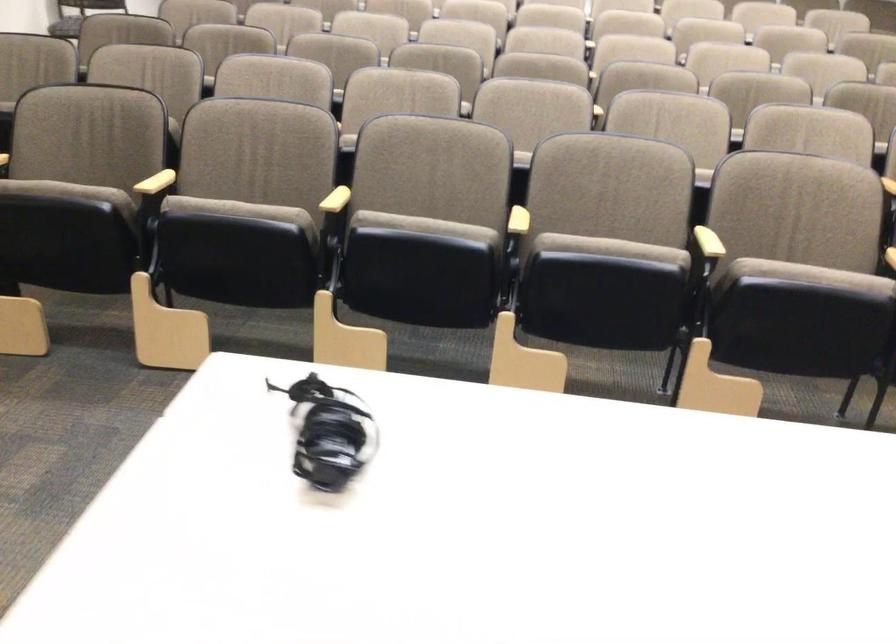
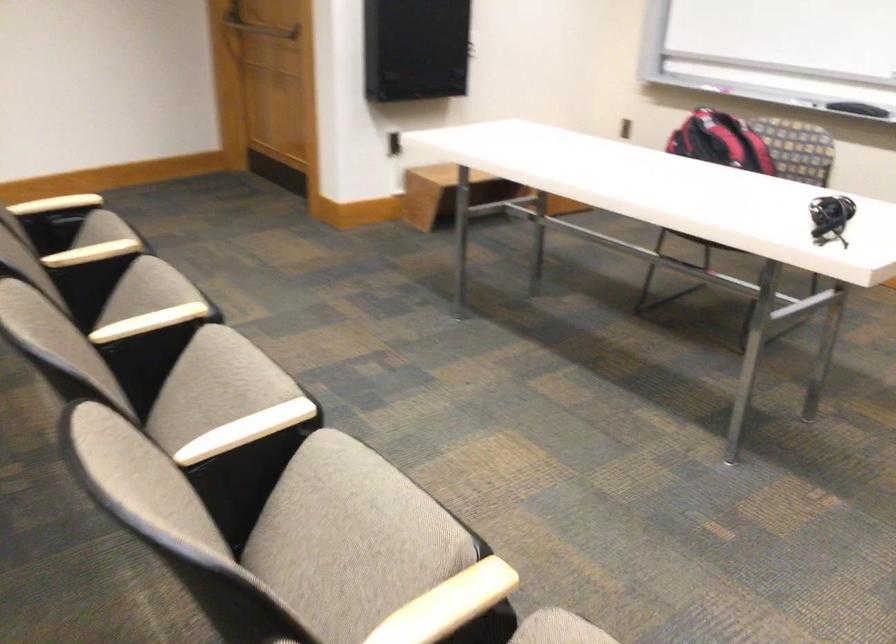
In the second image, find the point that corresponds to the point at 607,254 in the first image.

(214, 386)